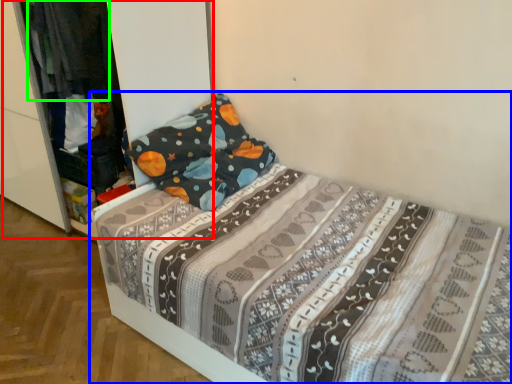
Question: Based on their relative distances, which object is farther from dresser (highlighted by a red box)? Choose from bed (highlighted by a blue box) and clothing (highlighted by a green box).

Choices:
 (A) bed
 (B) clothing

Answer: (A)